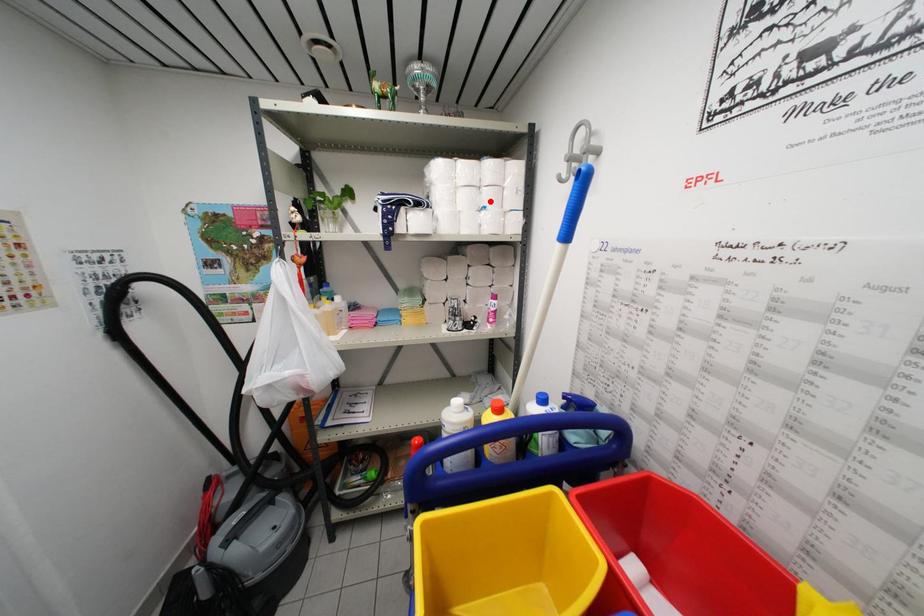
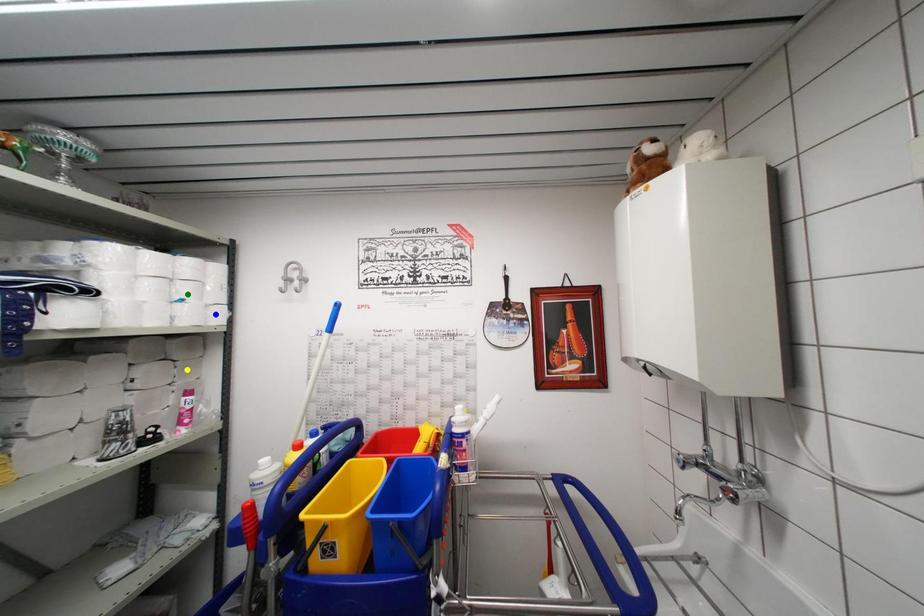
Question: I am providing you with two images of the same scene from different viewpoints. A red point is marked on the first image. You are given multiple points on the second image. In image 2, which mark is for the same physical point as the one in image 1?

Choices:
 (A) green point
 (B) yellow point
 (C) blue point

Answer: (A)